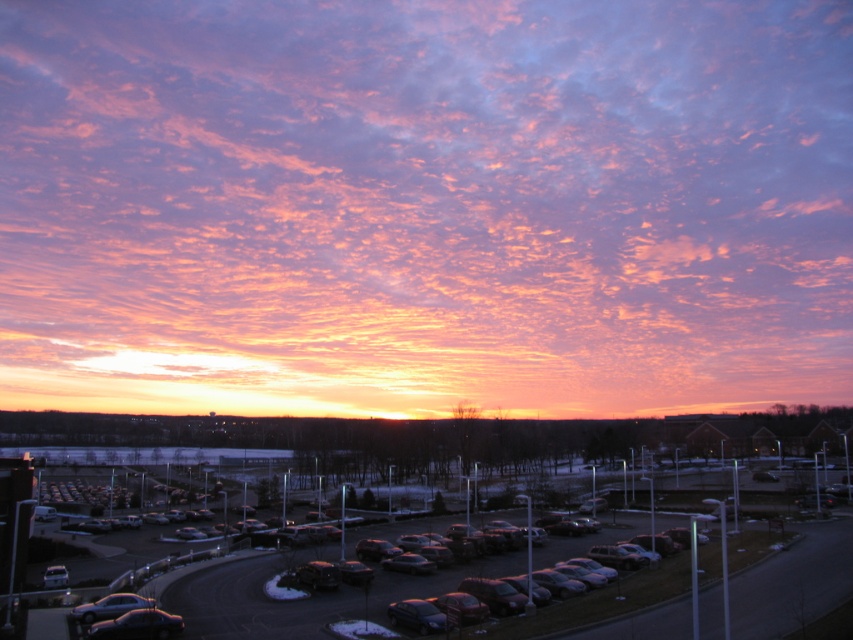
Can you confirm if black asphalt parking lot at lower center is smaller than shiny black car at lower left?

No.

Is black asphalt parking lot at lower center further to the viewer compared to shiny black car at lower left?

No, it is in front of shiny black car at lower left.

What do you see at coordinates (791, 580) in the screenshot? I see `black asphalt parking lot at lower center` at bounding box center [791, 580].

This screenshot has height=640, width=853. I want to click on black asphalt parking lot at lower center, so click(791, 580).

Does pink fluffy clouds at upper center have a larger size compared to black asphalt parking lot at lower center?

Correct, pink fluffy clouds at upper center is larger in size than black asphalt parking lot at lower center.

Is the position of pink fluffy clouds at upper center more distant than that of black asphalt parking lot at lower center?

Yes, pink fluffy clouds at upper center is further from the viewer.

The height and width of the screenshot is (640, 853). Identify the location of pink fluffy clouds at upper center. (424, 205).

Find the location of a particular element. pink fluffy clouds at upper center is located at coordinates (424, 205).

Which is below, pink fluffy clouds at upper center or shiny black car at lower left?

shiny black car at lower left

Is pink fluffy clouds at upper center thinner than shiny black car at lower left?

In fact, pink fluffy clouds at upper center might be wider than shiny black car at lower left.

Find the location of a particular element. pink fluffy clouds at upper center is located at coordinates (424, 205).